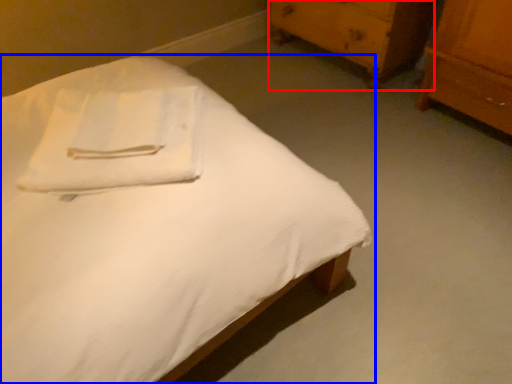
Question: Which object is further to the camera taking this photo, chest of drawers (highlighted by a red box) or bed (highlighted by a blue box)?

Choices:
 (A) chest of drawers
 (B) bed

Answer: (A)